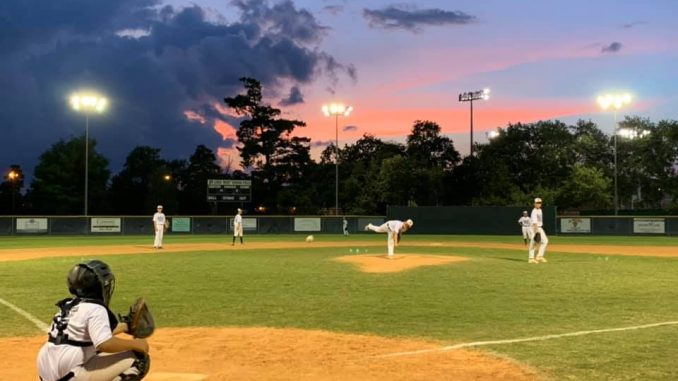
Find the location of `pitcher`. pitcher is located at coordinates (393, 226).